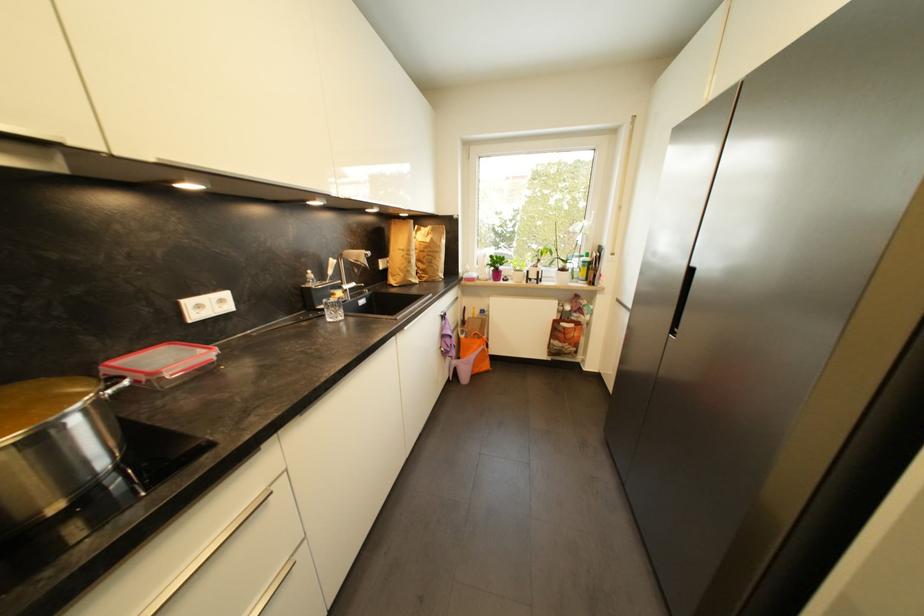
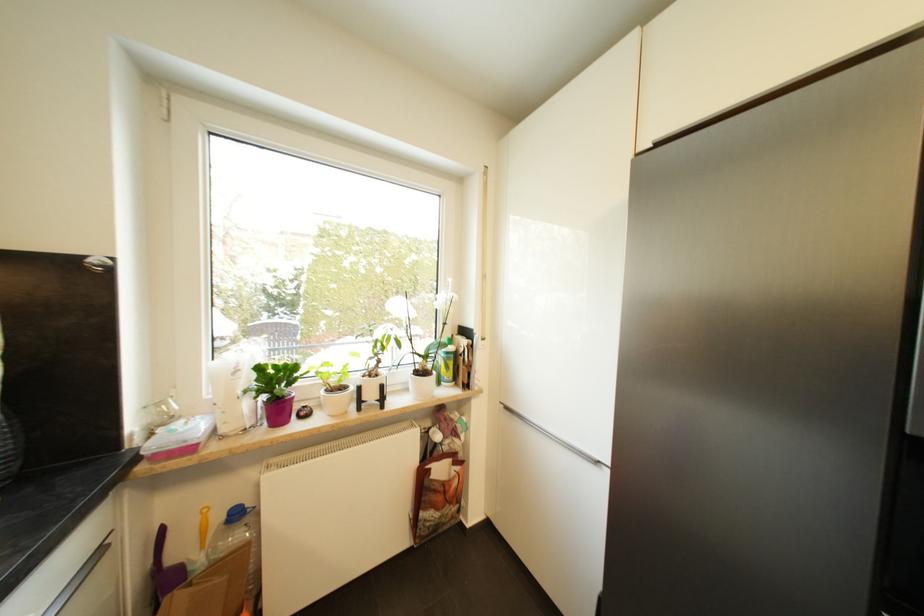
The point at (479, 306) is marked in the first image. Where is the corresponding point in the second image?

(207, 507)